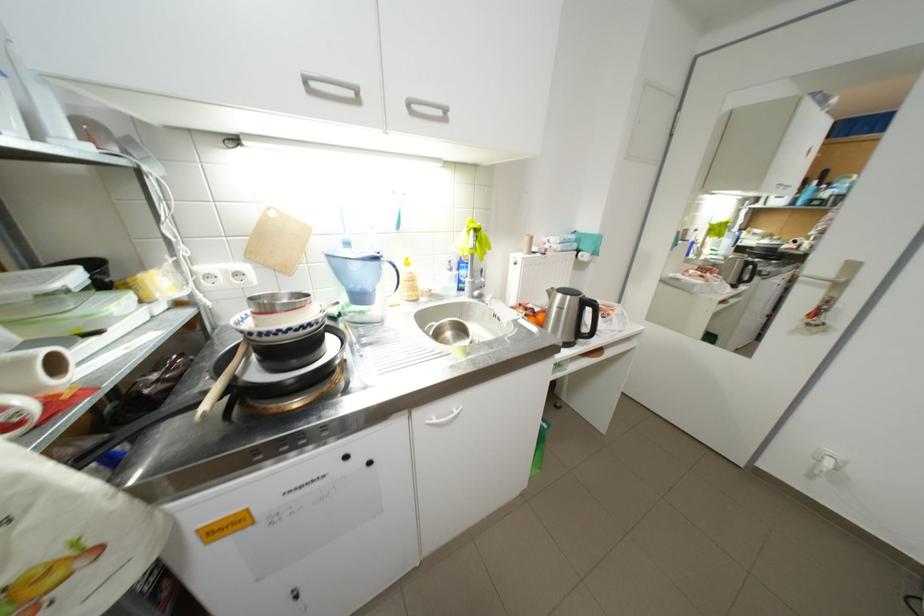
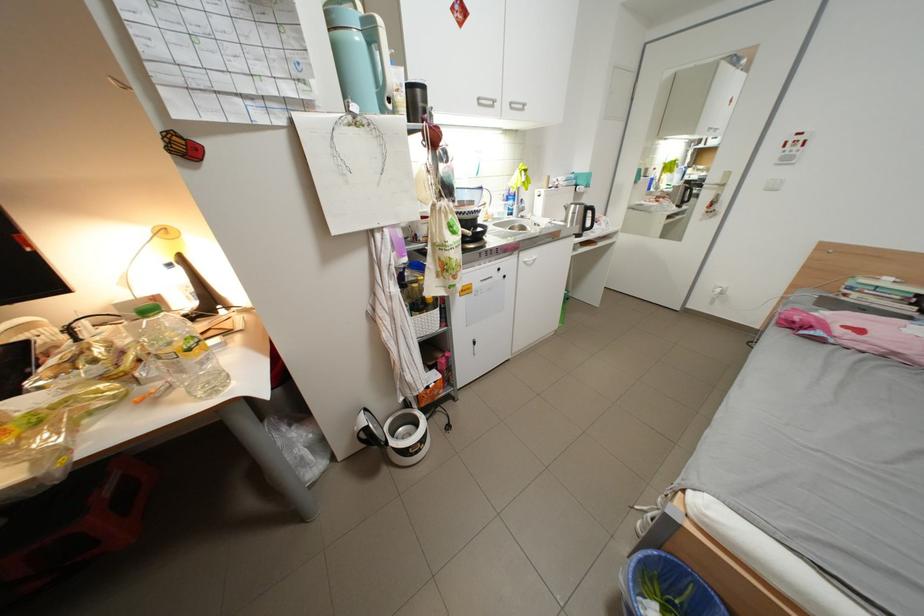
The point at (573, 309) is marked in the first image. Where is the corresponding point in the second image?

(585, 215)